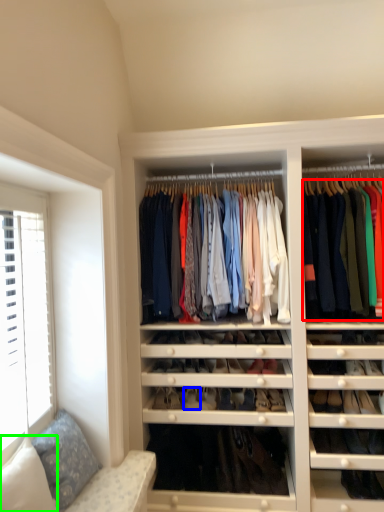
Question: Considering the real-world distances, which object is farthest from clothing (highlighted by a red box)? shoe (highlighted by a blue box) or pillow (highlighted by a green box)?

Choices:
 (A) shoe
 (B) pillow

Answer: (B)